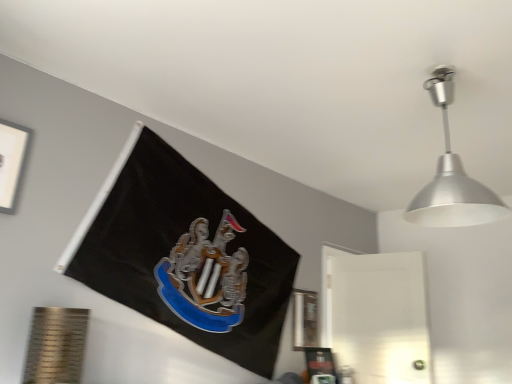
In order to face silver metallic lampshade at upper right, should I rotate leftwards or rightwards?

You should look right and rotate roughly 24.377 degrees.

This screenshot has height=384, width=512. What do you see at coordinates (305, 319) in the screenshot?
I see `metallic silver picture frame at lower right, which ranks as the 2th picture frame in front-to-back order` at bounding box center [305, 319].

At what (x,y) coordinates should I click in order to perform the action: click on silver metallic lampshade at upper right. Please return your answer as a coordinate pair (x, y). The image size is (512, 384). Looking at the image, I should click on (452, 177).

From the image's perspective, is white matte picture frame at upper left, the first picture frame when ordered from front to back, beneath metallic silver picture frame at lower right, which appears as the 1th picture frame when ordered from the bottom?

No, from the image's perspective, white matte picture frame at upper left, the first picture frame when ordered from front to back, is not beneath metallic silver picture frame at lower right, which appears as the 1th picture frame when ordered from the bottom.

Is the position of white matte picture frame at upper left, the second picture frame positioned from the bottom, more distant than that of metallic silver picture frame at lower right, arranged as the second picture frame when viewed from the left?

No, it is in front of metallic silver picture frame at lower right, arranged as the second picture frame when viewed from the left.

Identify the location of picture frame that is on the left side of metallic silver picture frame at lower right, which ranks as the 2th picture frame in front-to-back order. The height and width of the screenshot is (384, 512). (12, 163).

Is white matte picture frame at upper left, the second picture frame when ordered from back to front, taller than metallic silver picture frame at lower right, which is counted as the 1th picture frame, starting from the back?

No, white matte picture frame at upper left, the second picture frame when ordered from back to front, is not taller than metallic silver picture frame at lower right, which is counted as the 1th picture frame, starting from the back.

Considering the relative sizes of white matte picture frame at upper left, the second picture frame when ordered from back to front, and silver metallic lampshade at upper right in the image provided, is white matte picture frame at upper left, the second picture frame when ordered from back to front, bigger than silver metallic lampshade at upper right?

No, white matte picture frame at upper left, the second picture frame when ordered from back to front, is not bigger than silver metallic lampshade at upper right.

Would you say white matte picture frame at upper left, the first picture frame when ordered from front to back, is outside silver metallic lampshade at upper right?

white matte picture frame at upper left, the first picture frame when ordered from front to back, is positioned outside silver metallic lampshade at upper right.

How far apart are white matte picture frame at upper left, the second picture frame positioned from the bottom, and silver metallic lampshade at upper right?

They are 1.77 meters apart.

Is white matte picture frame at upper left, which is counted as the 1th picture frame, starting from the top, touching silver metallic lampshade at upper right?

white matte picture frame at upper left, which is counted as the 1th picture frame, starting from the top, is not next to silver metallic lampshade at upper right, and they're not touching.

Which object is closer to the camera, metallic silver picture frame at lower right, which ranks as the 2th picture frame in front-to-back order, or silver metallic lampshade at upper right?

silver metallic lampshade at upper right.

Is metallic silver picture frame at lower right, which ranks as the 2th picture frame in front-to-back order, spatially inside silver metallic lampshade at upper right, or outside of it?

metallic silver picture frame at lower right, which ranks as the 2th picture frame in front-to-back order, is not inside silver metallic lampshade at upper right, it's outside.

Does metallic silver picture frame at lower right, which is counted as the 1th picture frame, starting from the back, turn towards silver metallic lampshade at upper right?

No, metallic silver picture frame at lower right, which is counted as the 1th picture frame, starting from the back, is not facing towards silver metallic lampshade at upper right.

Who is taller, metallic silver picture frame at lower right, which ranks as the 2th picture frame in front-to-back order, or silver metallic lampshade at upper right?

silver metallic lampshade at upper right is taller.

Considering the relative sizes of silver metallic lampshade at upper right and metallic silver picture frame at lower right, which ranks as the second picture frame in top-to-bottom order, in the image provided, is silver metallic lampshade at upper right smaller than metallic silver picture frame at lower right, which ranks as the second picture frame in top-to-bottom order,?

No.

Find the location of a particular element. lamp that appears above the metallic silver picture frame at lower right, which appears as the 1th picture frame when ordered from the bottom (from the image's perspective) is located at coordinates (452, 177).

Does silver metallic lampshade at upper right turn towards metallic silver picture frame at lower right, which is counted as the 1th picture frame, starting from the back?

No, silver metallic lampshade at upper right is not aimed at metallic silver picture frame at lower right, which is counted as the 1th picture frame, starting from the back.

Is silver metallic lampshade at upper right in front of metallic silver picture frame at lower right, which ranks as the 2th picture frame in front-to-back order?

Yes, silver metallic lampshade at upper right is closer to the camera.

Is metallic silver picture frame at lower right, marked as the first picture frame in a right-to-left arrangement, bigger or smaller than white matte picture frame at upper left, the second picture frame positioned from the bottom?

In the image, metallic silver picture frame at lower right, marked as the first picture frame in a right-to-left arrangement, appears to be smaller than white matte picture frame at upper left, the second picture frame positioned from the bottom.

Considering the relative sizes of metallic silver picture frame at lower right, which appears as the 1th picture frame when ordered from the bottom, and white matte picture frame at upper left, which is the 2th picture frame from right to left, in the image provided, is metallic silver picture frame at lower right, which appears as the 1th picture frame when ordered from the bottom, shorter than white matte picture frame at upper left, which is the 2th picture frame from right to left,?

No.

Is metallic silver picture frame at lower right, which appears as the 1th picture frame when ordered from the bottom, far from white matte picture frame at upper left, the second picture frame positioned from the bottom?

Yes, metallic silver picture frame at lower right, which appears as the 1th picture frame when ordered from the bottom, and white matte picture frame at upper left, the second picture frame positioned from the bottom, are quite far apart.

Does point (499, 200) come closer to viewer compared to point (7, 166)?

Yes.

Is silver metallic lampshade at upper right next to white matte picture frame at upper left, placed as the 1th picture frame when sorted from left to right?

No.

From a real-world perspective, is silver metallic lampshade at upper right positioned over white matte picture frame at upper left, the first picture frame when ordered from front to back, based on gravity?

Yes, from a real-world perspective, silver metallic lampshade at upper right is over white matte picture frame at upper left, the first picture frame when ordered from front to back

From the image's perspective, is silver metallic lampshade at upper right located above white matte picture frame at upper left, which is the 2th picture frame from right to left?

Yes, from the image's perspective, silver metallic lampshade at upper right is over white matte picture frame at upper left, which is the 2th picture frame from right to left.

Where is `picture frame located in front of the metallic silver picture frame at lower right, marked as the first picture frame in a right-to-left arrangement`? Image resolution: width=512 pixels, height=384 pixels. picture frame located in front of the metallic silver picture frame at lower right, marked as the first picture frame in a right-to-left arrangement is located at coordinates (12, 163).

The width and height of the screenshot is (512, 384). There is a silver metallic lampshade at upper right. Find the location of `the 1st picture frame below it (from the image's perspective)`. the 1st picture frame below it (from the image's perspective) is located at coordinates (12, 163).

From the image, which object appears to be farther from metallic silver picture frame at lower right, which ranks as the second picture frame in top-to-bottom order, white matte picture frame at upper left, which is counted as the 1th picture frame, starting from the top, or silver metallic lampshade at upper right?

The object further to metallic silver picture frame at lower right, which ranks as the second picture frame in top-to-bottom order, is white matte picture frame at upper left, which is counted as the 1th picture frame, starting from the top.

Based on the photo, estimate the real-world distances between objects in this image. Which object is further from white matte picture frame at upper left, which is counted as the 1th picture frame, starting from the top, metallic silver picture frame at lower right, which ranks as the second picture frame in top-to-bottom order, or silver metallic lampshade at upper right?

metallic silver picture frame at lower right, which ranks as the second picture frame in top-to-bottom order, is further to white matte picture frame at upper left, which is counted as the 1th picture frame, starting from the top.

Which object lies further to the anchor point silver metallic lampshade at upper right, metallic silver picture frame at lower right, marked as the first picture frame in a right-to-left arrangement, or white matte picture frame at upper left, which is the 2th picture frame from right to left?

white matte picture frame at upper left, which is the 2th picture frame from right to left, is positioned further to the anchor silver metallic lampshade at upper right.

Looking at the image, which one is located further to silver metallic lampshade at upper right, white matte picture frame at upper left, the second picture frame positioned from the bottom, or metallic silver picture frame at lower right, marked as the first picture frame in a right-to-left arrangement?

white matte picture frame at upper left, the second picture frame positioned from the bottom.

Looking at the image, which one is located closer to white matte picture frame at upper left, which is counted as the 1th picture frame, starting from the top, silver metallic lampshade at upper right or metallic silver picture frame at lower right, which ranks as the 2th picture frame in front-to-back order?

silver metallic lampshade at upper right lies closer to white matte picture frame at upper left, which is counted as the 1th picture frame, starting from the top, than the other object.

When comparing their distances from metallic silver picture frame at lower right, which appears as the 1th picture frame when ordered from the bottom, does silver metallic lampshade at upper right or white matte picture frame at upper left, which is counted as the 1th picture frame, starting from the top, seem further?

white matte picture frame at upper left, which is counted as the 1th picture frame, starting from the top, is positioned further to the anchor metallic silver picture frame at lower right, which appears as the 1th picture frame when ordered from the bottom.

You are a GUI agent. You are given a task and a screenshot of the screen. Output one action in this format:
    pyautogui.click(x=<x>, y=<y>)
    Task: Click on the picture frame between white matte picture frame at upper left, the first picture frame when ordered from front to back, and silver metallic lampshade at upper right, in the horizontal direction
    
    Given the screenshot: What is the action you would take?
    click(x=305, y=319)